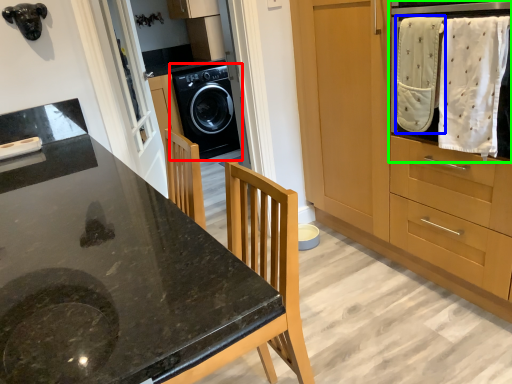
Question: Considering the real-world distances, which object is closest to washing machine (highlighted by a red box)? baby clothe (highlighted by a blue box) or home appliance (highlighted by a green box).

Choices:
 (A) baby clothe
 (B) home appliance

Answer: (A)